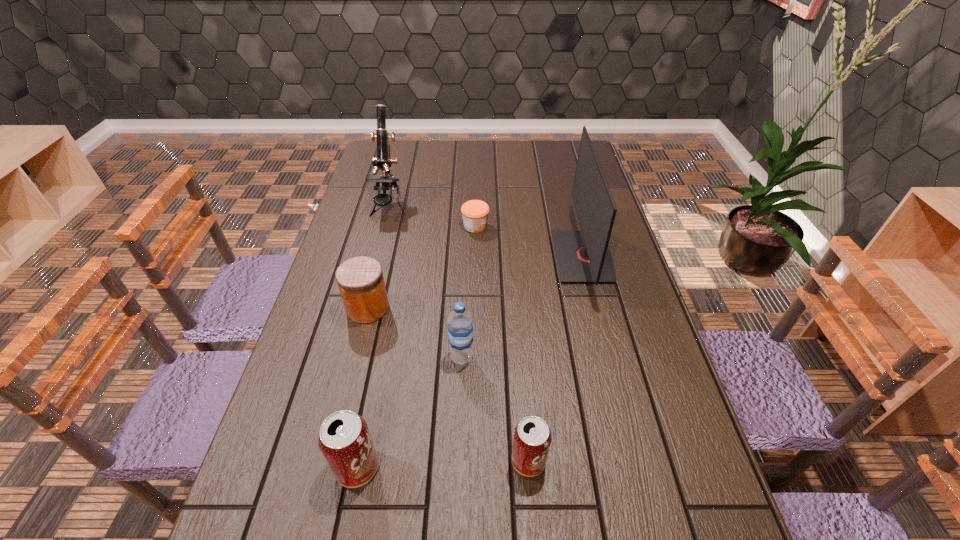
Locate an element on the screen. This screenshot has width=960, height=540. object that is at the right edge is located at coordinates (583, 255).

Where is `object located at the near left corner`? The image size is (960, 540). object located at the near left corner is located at coordinates (345, 441).

Where is `vacant space at the far edge of the desktop`? Image resolution: width=960 pixels, height=540 pixels. vacant space at the far edge of the desktop is located at coordinates (436, 156).

This screenshot has width=960, height=540. In the image, there is a desktop. What are the coordinates of `free region at the near edge` in the screenshot? It's located at (492, 513).

Find the location of a particular element. free location at the left edge of the desktop is located at coordinates (261, 472).

Image resolution: width=960 pixels, height=540 pixels. Identify the location of vacant space at the right edge. (636, 470).

In the image, there is a desktop. Where is `blank space at the far left corner`? blank space at the far left corner is located at coordinates (374, 147).

The image size is (960, 540). In the image, there is a desktop. What are the coordinates of `blank space at the far right corner` in the screenshot? It's located at (566, 168).

Image resolution: width=960 pixels, height=540 pixels. In order to click on vacant point located between the shortest object and the jar in this screenshot , I will do `click(421, 267)`.

The width and height of the screenshot is (960, 540). In order to click on blank region between the right soda can and the jar in this screenshot , I will do 448,384.